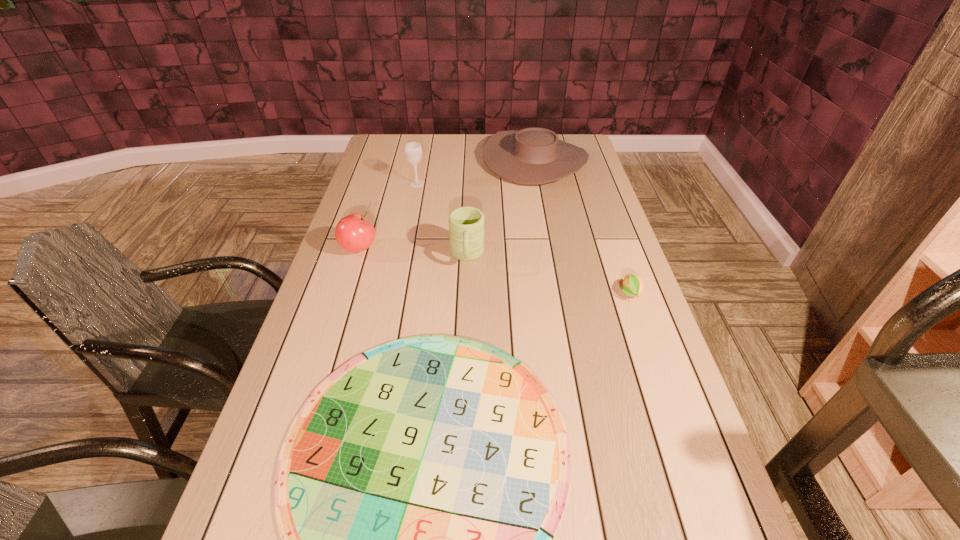
Find the location of a particular element. The image size is (960, 540). vacant area between the cowboy hat and the mug is located at coordinates (501, 208).

This screenshot has width=960, height=540. What are the coordinates of `vacant space in between the apple and the cowboy hat` in the screenshot? It's located at (446, 205).

The width and height of the screenshot is (960, 540). In order to click on free area in between the apple and the lemon in this screenshot , I will do coord(494,271).

At what (x,y) coordinates should I click in order to perform the action: click on vacant region between the wineglass and the apple. Please return your answer as a coordinate pair (x, y). The width and height of the screenshot is (960, 540). Looking at the image, I should click on (388, 216).

In order to click on free space between the mug and the apple in this screenshot , I will do `click(413, 252)`.

You are a GUI agent. You are given a task and a screenshot of the screen. Output one action in this format:
    pyautogui.click(x=<x>, y=<y>)
    Task: Click on the blank region between the apple and the mug
    
    Given the screenshot: What is the action you would take?
    pyautogui.click(x=413, y=252)

Where is `empty space that is in between the tallest object and the mug`? The image size is (960, 540). empty space that is in between the tallest object and the mug is located at coordinates (443, 220).

Locate which object is the fourth closest to the fifth farthest object. Please provide its 2D coordinates. Your answer should be formatted as a tuple, i.e. [(x, y)], where the tuple contains the x and y coordinates of a point satisfying the conditions above.

[(354, 233)]

Identify the location of object that is the fifth closest one to the apple. This screenshot has width=960, height=540. (633, 285).